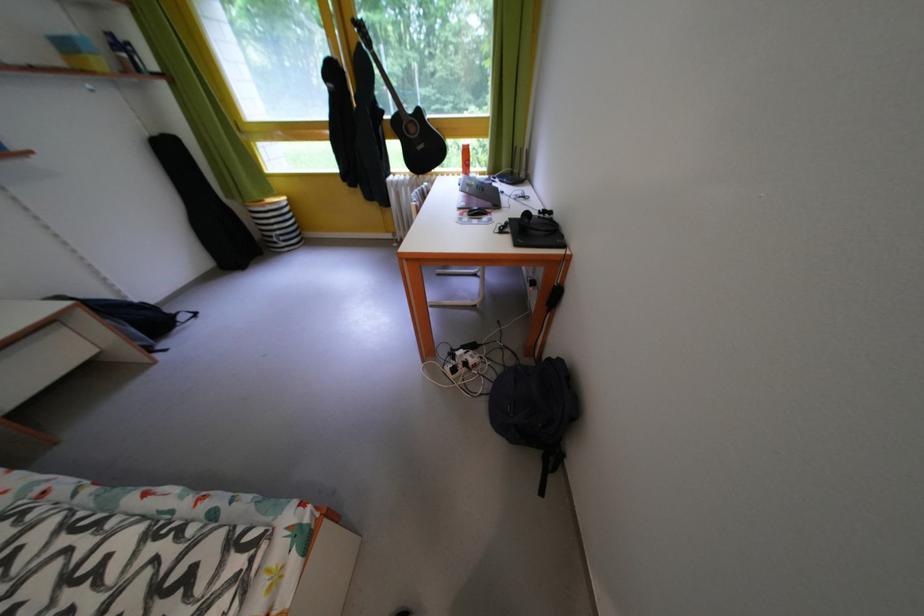
Find where to lift the red bottle. Please return your answer as a coordinate pair (x, y).

(465, 159)